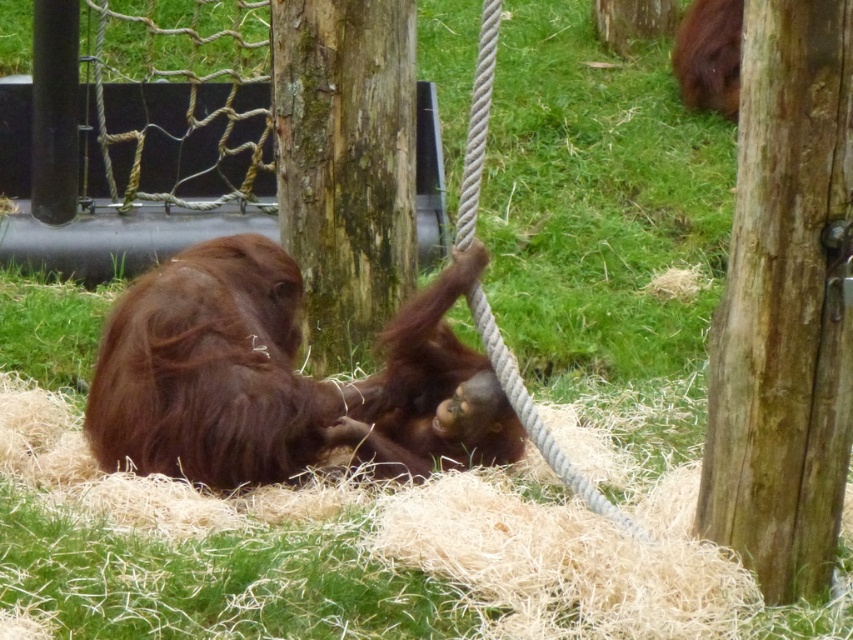
You are a zookeeper planning to place a new feeding tray in the enclosure. The tray requires a space larger than the brown furry orangutan at center. Can you place it on the brown rough wood at center?

The brown rough wood at center is bigger than the brown furry orangutan at center, so yes, the feeding tray can be placed there as it has sufficient space.

You are standing in front of the orangutan enclosure and want to determine which of the two points, point (767, 150) or point (103, 440), is nearer to you. Based on the scene description, which point is closer?

Point (767, 150) is closer to the viewer than point (103, 440) according to the description.